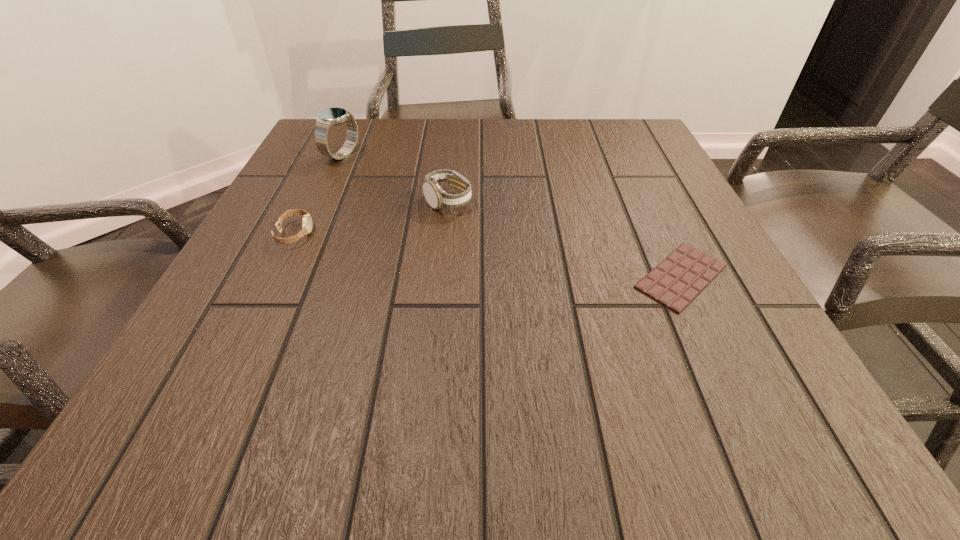
Locate an element on the screen. This screenshot has height=540, width=960. the tallest watch is located at coordinates coord(328,117).

Where is `the farthest watch`? The width and height of the screenshot is (960, 540). the farthest watch is located at coordinates pyautogui.click(x=328, y=117).

This screenshot has width=960, height=540. Find the location of `the rightmost watch`. the rightmost watch is located at coordinates (436, 197).

Where is `the second shortest watch`? the second shortest watch is located at coordinates (436, 197).

This screenshot has height=540, width=960. Identify the location of the shortest watch. (307, 220).

The width and height of the screenshot is (960, 540). Find the location of `the third tallest object`. the third tallest object is located at coordinates (307, 220).

This screenshot has height=540, width=960. Identify the location of chocolate bar. (681, 276).

Find the location of a particular element. the rightmost object is located at coordinates (681, 276).

Locate an element on the screen. The width and height of the screenshot is (960, 540). vacant space located on the right of the farthest object is located at coordinates (497, 155).

This screenshot has width=960, height=540. Find the location of `free space located on the face of the second farthest watch`. free space located on the face of the second farthest watch is located at coordinates (435, 339).